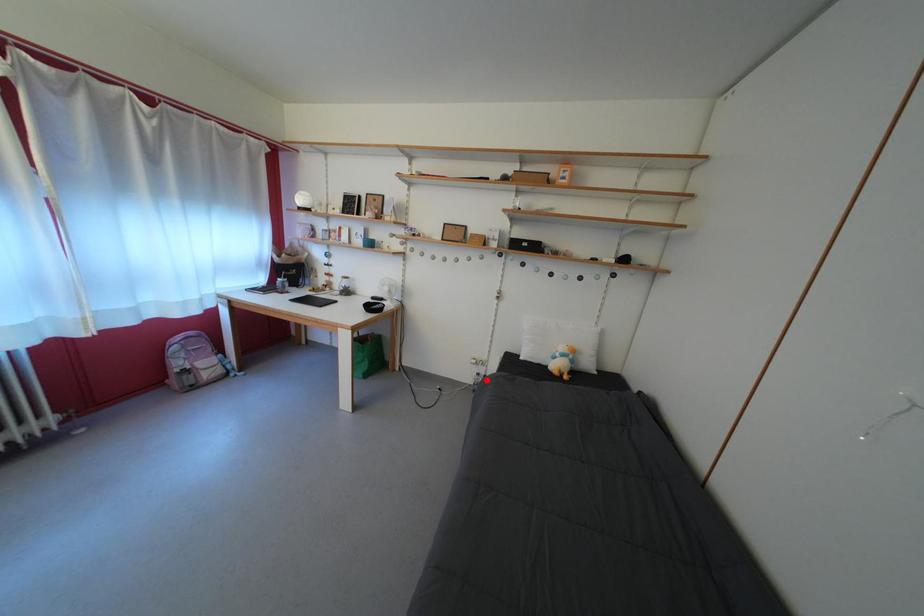
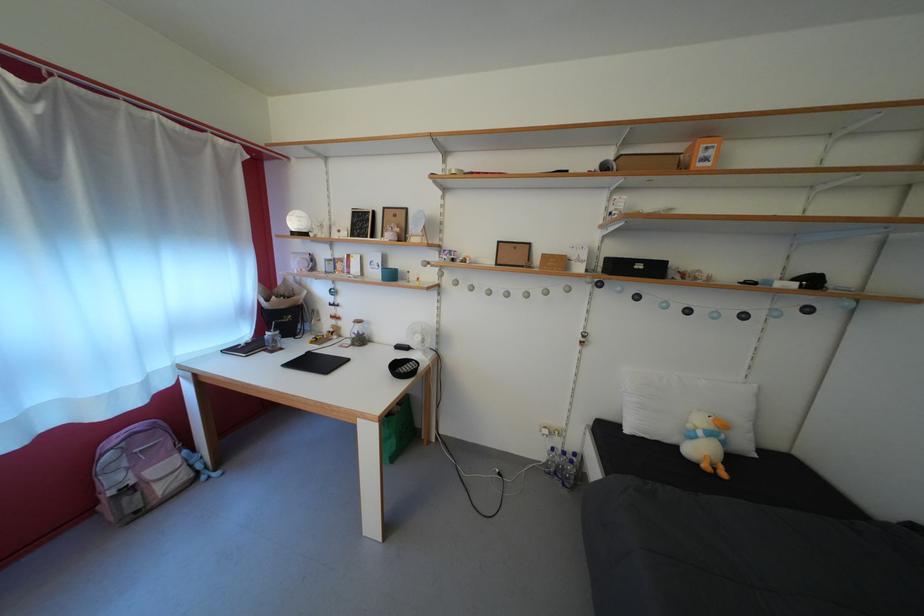
Find the pixel in the second image that matches the highlighted location in the first image.

(562, 455)